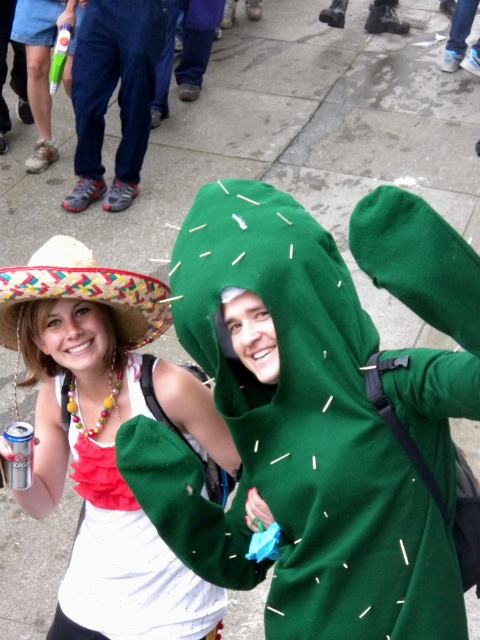
Is point (135, 385) positioned before point (22, 429)?

No.

Between matte white tank top at center and silver metallic can at lower left, which one appears on the right side from the viewer's perspective?

Positioned to the right is matte white tank top at center.

Identify the location of matte white tank top at center. (97, 442).

Is bright yellow straw hat at lower left positioned before silver metallic can at lower left?

Yes, it is in front of silver metallic can at lower left.

Describe the element at coordinates (84, 291) in the screenshot. I see `bright yellow straw hat at lower left` at that location.

Locate an element on the screen. bright yellow straw hat at lower left is located at coordinates (84, 291).

Can you confirm if matte white tank top at center is smaller than bright yellow straw hat at lower left?

Actually, matte white tank top at center might be larger than bright yellow straw hat at lower left.

Who is positioned more to the left, matte white tank top at center or bright yellow straw hat at lower left?

bright yellow straw hat at lower left

Is point (37, 320) closer to camera compared to point (38, 282)?

No.

In order to click on matte white tank top at center in this screenshot , I will do `click(97, 442)`.